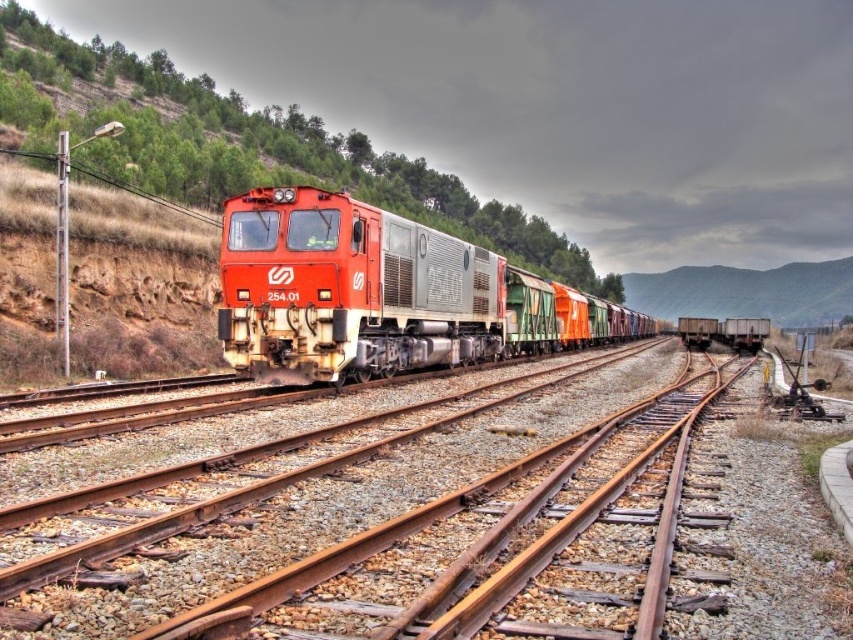
You are a railway inspector checking the infrastructure. You notice the rusty metal tracks at center and the green matte hillside at center. Which one has a smaller width?

The rusty metal tracks at center has a smaller width than the green matte hillside at center.

You are a photographer standing at the center of the scene. You want to capture a photo where the rusty metal tracks at center are clearly visible below the matte red train at center. Is the height difference between them sufficient for this?

The rusty metal tracks at center are not as tall as the matte red train at center, so yes, the height difference allows the tracks to be visible below the train in the photo.

You are a photographer trying to capture the matte red train at center and the green matte hillside at center in a single shot. Based on their widths, which object should you focus on to ensure both fit in the frame without cropping?

The matte red train at center is thinner than the green matte hillside at center. To ensure both fit in the frame without cropping, focus on the wider object, the green matte hillside at center, as it requires more space.